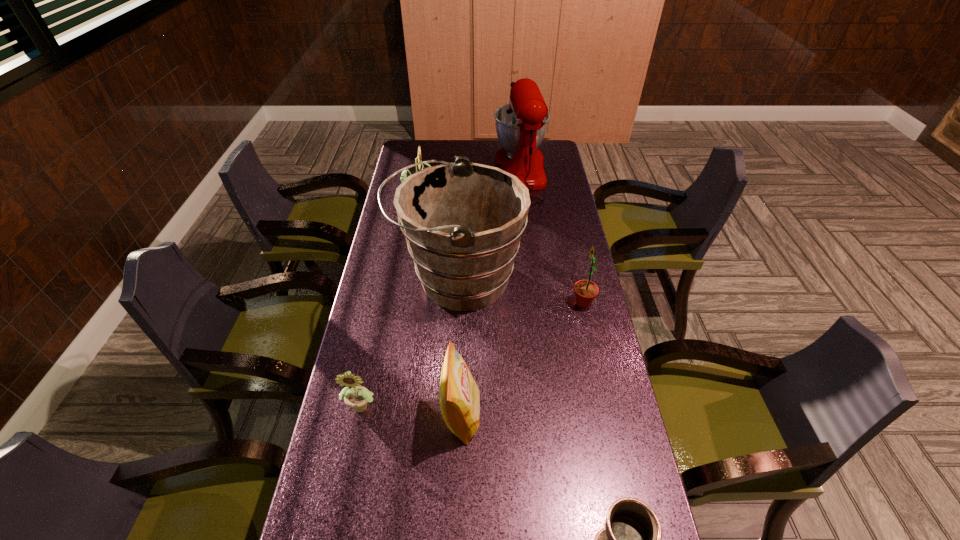
Find the location of `object situated at the far edge`. object situated at the far edge is located at coordinates (521, 125).

What are the coordinates of `bucket present at the left edge` in the screenshot? It's located at (463, 221).

Locate an element on the screen. This screenshot has width=960, height=540. mixer that is at the right edge is located at coordinates (521, 125).

At what (x,y) coordinates should I click in order to perform the action: click on sunflower present at the right edge. Please return your answer as a coordinate pair (x, y). This screenshot has height=540, width=960. Looking at the image, I should click on (586, 291).

Where is `object at the far right corner`? The image size is (960, 540). object at the far right corner is located at coordinates (521, 125).

Image resolution: width=960 pixels, height=540 pixels. Find the location of `vacant region at the far edge`. vacant region at the far edge is located at coordinates (446, 157).

The width and height of the screenshot is (960, 540). Find the location of `blank area at the left edge`. blank area at the left edge is located at coordinates (401, 356).

In the image, there is a desktop. Where is `vacant space at the right edge`? This screenshot has height=540, width=960. vacant space at the right edge is located at coordinates (576, 450).

I want to click on object that stands as the sixth closest to the shortest sunflower, so click(521, 125).

Find the location of `the closest object to the bucket`. the closest object to the bucket is located at coordinates (586, 291).